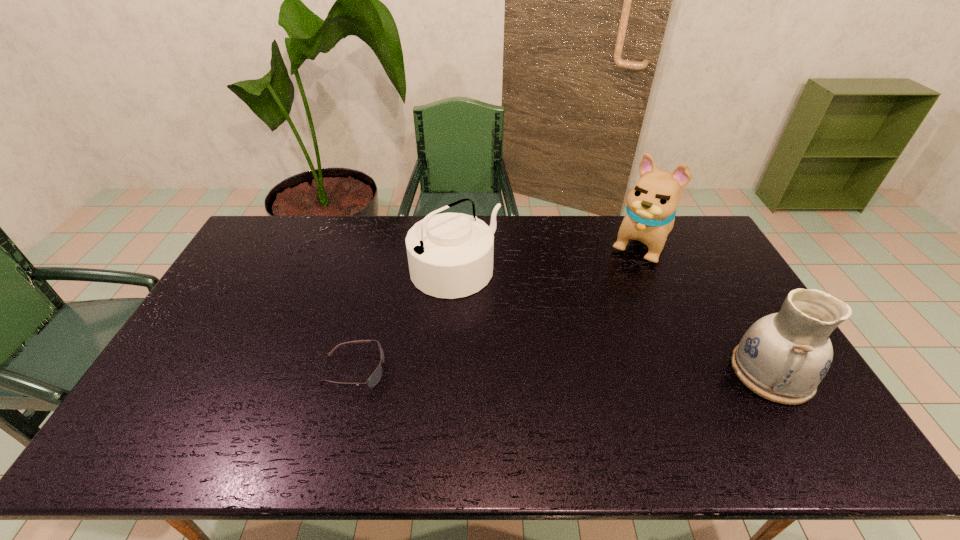
Identify the location of free space on the desktop that is between the shortest object and the pottery and is positioned on the spout of the third object from right to left. (575, 372).

Locate an element on the screen. free space on the desktop that is between the shortest object and the pottery and is positioned on the face of the puppy is located at coordinates (554, 372).